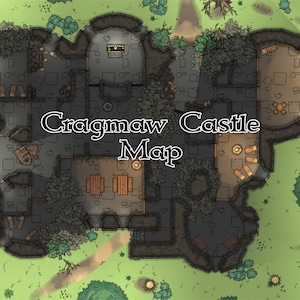
The image size is (300, 300). Identify the location of beds. (32, 234), (21, 223), (12, 223), (235, 175), (250, 171), (254, 159), (254, 149), (20, 90), (12, 94), (2, 94).